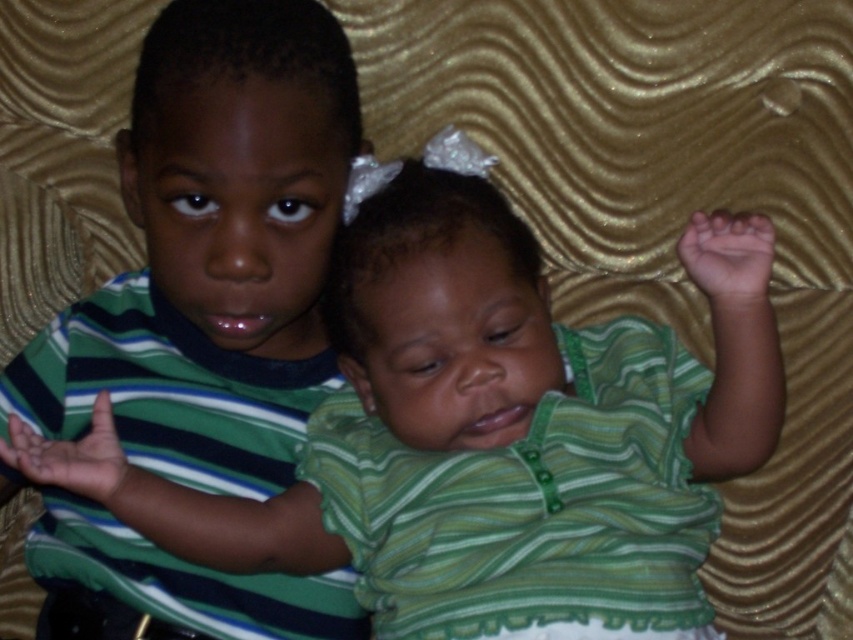
Question: Does green striped shirt at center have a greater width compared to green striped shirt at left?

Choices:
 (A) yes
 (B) no

Answer: (A)

Question: Does green striped shirt at center have a lesser width compared to green striped shirt at left?

Choices:
 (A) yes
 (B) no

Answer: (B)

Question: Which point is farther from the camera taking this photo?

Choices:
 (A) (389, 593)
 (B) (248, 38)

Answer: (A)

Question: Can you confirm if green striped shirt at center is wider than green striped shirt at left?

Choices:
 (A) yes
 (B) no

Answer: (A)